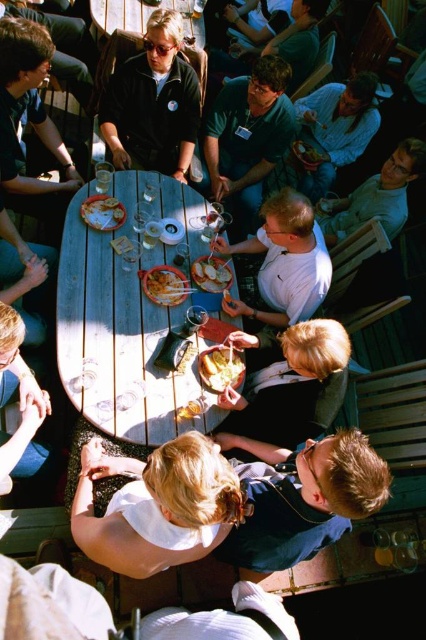
You are at the coordinates point 0.5, 0.3. Is the wooden table at center in front of you?

Yes, the wooden table at center is located at point (126, 316), which is very close to your current position at (127, 320). Therefore, the wooden table at center is directly in front of you.

You are a guest at the outdoor gathering and want to place your napkin on the smooth white plate at center. Can you reach the plate without moving the wooden table at center?

The wooden table at center is located above the smooth white plate at center, so the plate is underneath the table. Since the table is in the way, you cannot reach the plate without moving the wooden table at center.